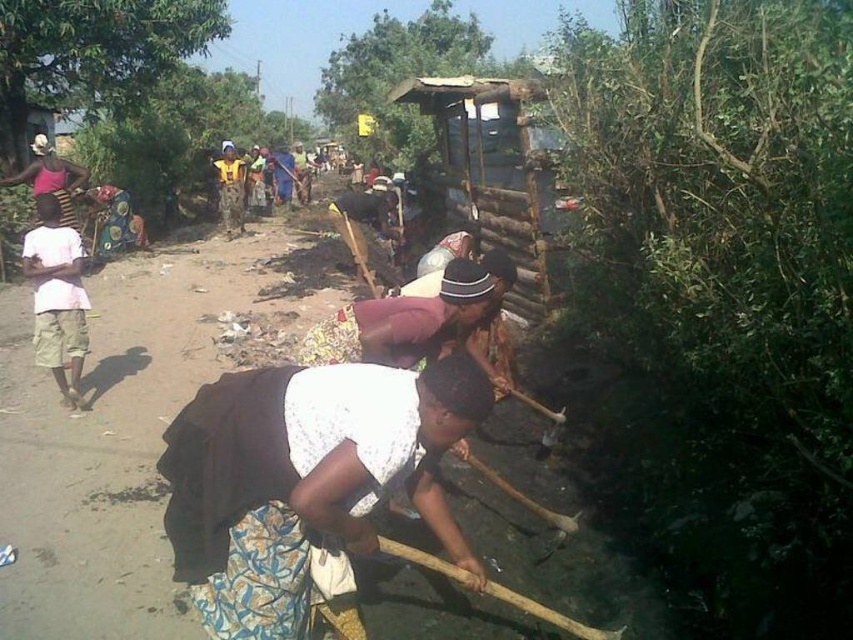
Does green leafy tree at right come behind green leafy tree at upper center?

No.

Is point (751, 56) in front of point (355, 54)?

Yes, it is in front of point (355, 54).

Who is more distant from viewer, (607, 387) or (392, 74)?

The point (392, 74) is behind.

The width and height of the screenshot is (853, 640). I want to click on green leafy tree at right, so tap(723, 291).

Based on the photo, between green leafy tree at right and green leafy tree at upper left, which one is positioned lower?

Positioned lower is green leafy tree at right.

Is point (811, 406) closer to viewer compared to point (86, 10)?

Yes.

Which is behind, point (726, 45) or point (207, 10)?

The point (207, 10) is behind.

Image resolution: width=853 pixels, height=640 pixels. In order to click on green leafy tree at right in this screenshot , I will do pyautogui.click(x=723, y=291).

How much distance is there between green leafy tree at upper left and green leafy tree at upper center?

green leafy tree at upper left and green leafy tree at upper center are 8.35 meters apart.

Does point (189, 51) lie behind point (338, 81)?

That is False.

Locate an element on the screen. This screenshot has width=853, height=640. green leafy tree at upper left is located at coordinates click(x=91, y=52).